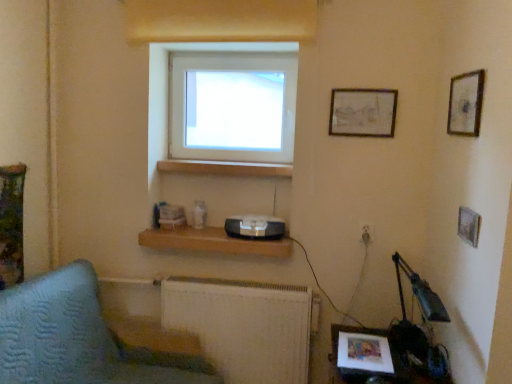
Question: Is textured fabric sofa at lower left completely or partially inside matte wooden picture frame at upper right, which ranks as the 2th picture frame in right-to-left order?

Choices:
 (A) yes
 (B) no

Answer: (B)

Question: Can you confirm if matte wooden picture frame at upper right, which ranks as the 2th picture frame in right-to-left order, is positioned to the left of textured fabric sofa at lower left?

Choices:
 (A) yes
 (B) no

Answer: (B)

Question: Does matte wooden picture frame at upper right, acting as the first picture frame starting from the back, have a larger size compared to textured fabric sofa at lower left?

Choices:
 (A) no
 (B) yes

Answer: (A)

Question: Is the position of matte wooden picture frame at upper right, which ranks as the 2th picture frame in right-to-left order, more distant than that of textured fabric sofa at lower left?

Choices:
 (A) no
 (B) yes

Answer: (B)

Question: From the image's perspective, does matte wooden picture frame at upper right, which appears as the first picture frame when viewed from the left, appear higher than textured fabric sofa at lower left?

Choices:
 (A) no
 (B) yes

Answer: (B)

Question: Does matte wooden picture frame at upper right, acting as the first picture frame starting from the back, have a smaller size compared to textured fabric sofa at lower left?

Choices:
 (A) yes
 (B) no

Answer: (A)

Question: Does wooden framed picture at upper right, which ranks as the 2th picture frame in left-to-right order, appear on the left side of white metallic radiator at lower center?

Choices:
 (A) no
 (B) yes

Answer: (A)

Question: From a real-world perspective, is wooden framed picture at upper right, which ranks as the 2th picture frame in left-to-right order, on top of white metallic radiator at lower center?

Choices:
 (A) yes
 (B) no

Answer: (A)

Question: Considering the relative sizes of wooden framed picture at upper right, the 2th picture frame from the back, and white metallic radiator at lower center in the image provided, is wooden framed picture at upper right, the 2th picture frame from the back, thinner than white metallic radiator at lower center?

Choices:
 (A) no
 (B) yes

Answer: (B)

Question: Is wooden framed picture at upper right, the 2th picture frame from the back, outside white metallic radiator at lower center?

Choices:
 (A) yes
 (B) no

Answer: (A)

Question: Is wooden framed picture at upper right, the first picture frame viewed from the front, behind white metallic radiator at lower center?

Choices:
 (A) no
 (B) yes

Answer: (A)

Question: Does wooden framed picture at upper right, which ranks as the 2th picture frame in left-to-right order, have a larger size compared to white metallic radiator at lower center?

Choices:
 (A) yes
 (B) no

Answer: (B)

Question: Is matte wooden picture frame at upper right, which is the second picture frame in front-to-back order, at the right side of white plastic electric outlet at lower right?

Choices:
 (A) no
 (B) yes

Answer: (A)